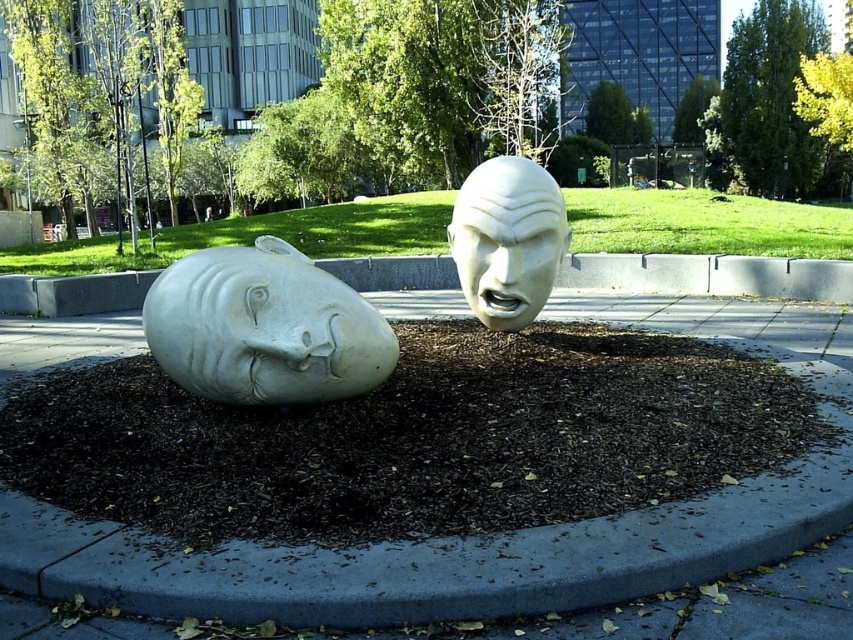
Is white marble head at left to the left of white marble face at center from the viewer's perspective?

Yes, white marble head at left is to the left of white marble face at center.

Can you confirm if white marble head at left is positioned above white marble face at center?

Incorrect, white marble head at left is not positioned above white marble face at center.

Identify the location of white marble head at left. click(x=264, y=326).

Which is behind, point (631, 467) or point (270, 394)?

Positioned behind is point (270, 394).

The width and height of the screenshot is (853, 640). I want to click on white matte sculpture at center, so click(x=415, y=438).

Does white matte sculpture at center appear over white marble face at center?

Actually, white matte sculpture at center is below white marble face at center.

Image resolution: width=853 pixels, height=640 pixels. Describe the element at coordinates (415, 438) in the screenshot. I see `white matte sculpture at center` at that location.

Does point (717, 429) come in front of point (509, 220)?

Yes, it is in front of point (509, 220).

At what (x,y) coordinates should I click in order to perform the action: click on white matte sculpture at center. Please return your answer as a coordinate pair (x, y). Image resolution: width=853 pixels, height=640 pixels. Looking at the image, I should click on (415, 438).